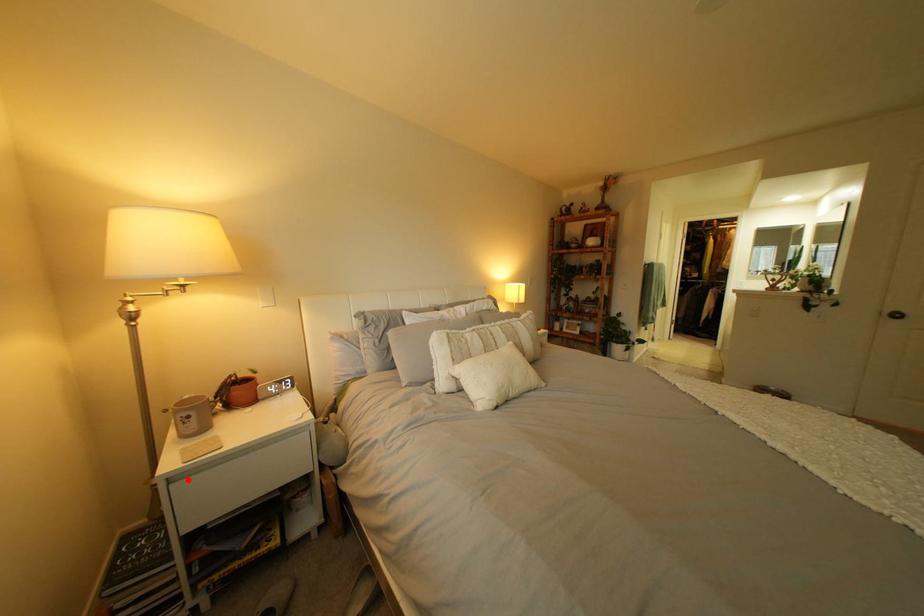
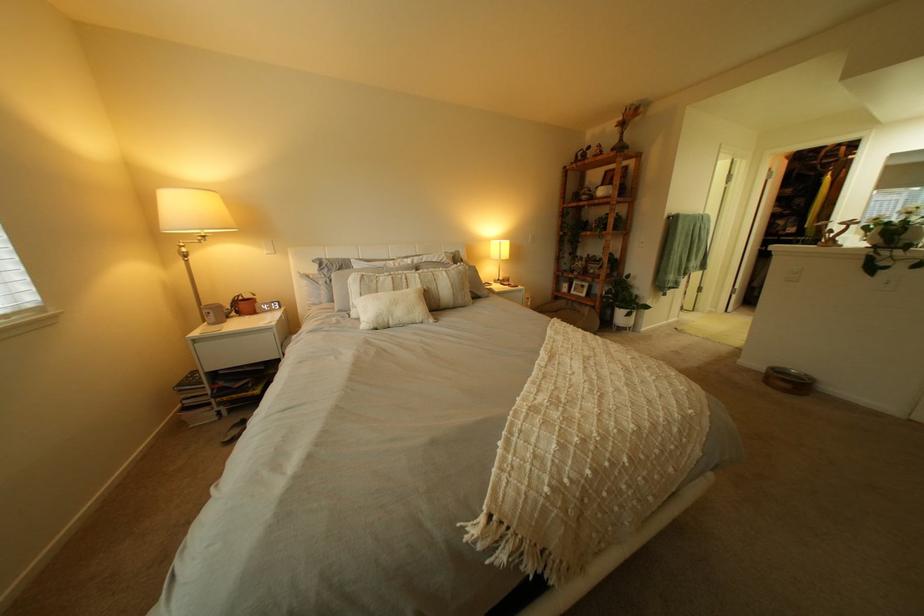
Question: A red point is marked in image1. In image2, is the corresponding 3D point closer to the camera or farther? Reply with the corresponding letter.

Choices:
 (A) The corresponding 3D point is closer.
 (B) The corresponding 3D point is farther.

Answer: (A)